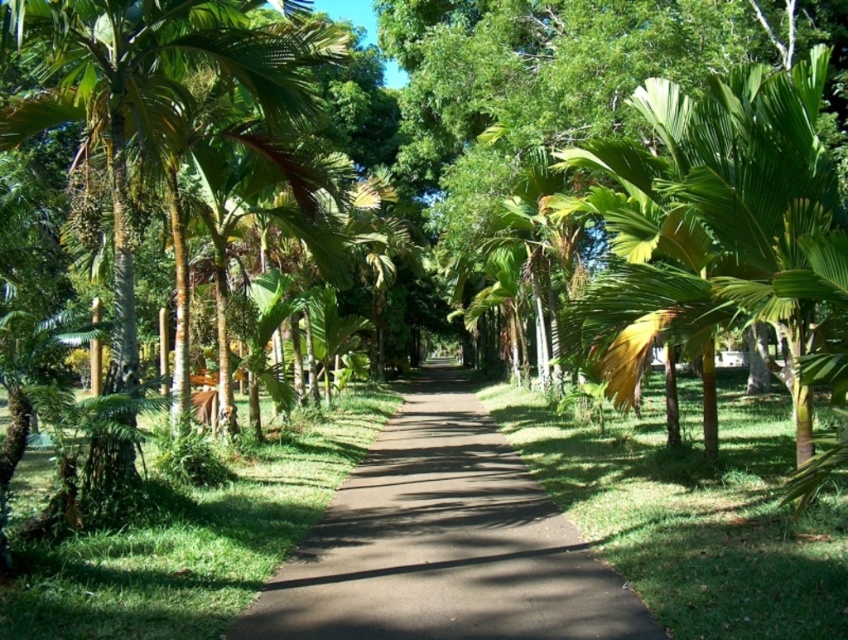
Between point (308, 561) and point (600, 476), which one is positioned behind?

Point (600, 476)

Does brown asphalt pavement at center have a lesser width compared to green grass at center?

Yes, brown asphalt pavement at center is thinner than green grass at center.

Who is more distant from viewer, (499,456) or (667,566)?

Point (499,456)

Where is `brown asphalt pavement at center`? brown asphalt pavement at center is located at coordinates (444, 544).

Where is `green grass at center`? The image size is (848, 640). green grass at center is located at coordinates (692, 509).

Does green grass at center lie behind green leafy palm tree at left?

No, it is in front of green leafy palm tree at left.

Is point (657, 385) more distant than point (96, 444)?

Yes, it is behind point (96, 444).

Find the location of a particular element. The height and width of the screenshot is (640, 848). green grass at center is located at coordinates (692, 509).

From the picture: Does green leafy palm at center appear over brown asphalt pavement at center?

Indeed, green leafy palm at center is positioned over brown asphalt pavement at center.

Does green leafy palm at center have a greater width compared to brown asphalt pavement at center?

No.

Identify the location of green leafy palm at center. The width and height of the screenshot is (848, 640). (721, 236).